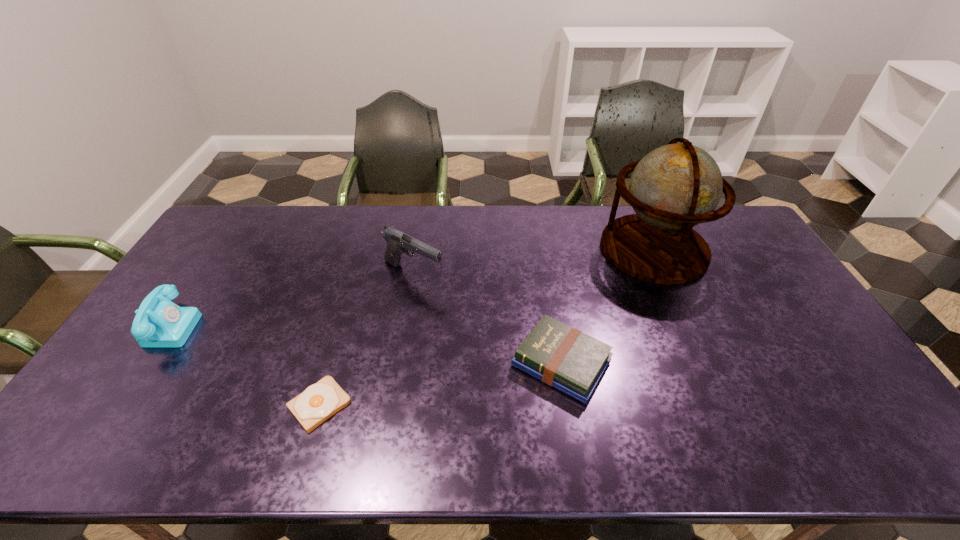
At what (x,y) coordinates should I click in order to perform the action: click on the tallest object. Please return your answer as a coordinate pair (x, y). Looking at the image, I should click on (675, 187).

Where is `the rightmost object`? This screenshot has height=540, width=960. the rightmost object is located at coordinates (675, 187).

Where is `gun`? Image resolution: width=960 pixels, height=540 pixels. gun is located at coordinates (398, 242).

Image resolution: width=960 pixels, height=540 pixels. I want to click on the leftmost object, so click(159, 323).

Where is `the third tallest object`? the third tallest object is located at coordinates (159, 323).

You are a GUI agent. You are given a task and a screenshot of the screen. Output one action in this format:
    pyautogui.click(x=<x>, y=<y>)
    Task: Click on the book
    Image resolution: width=960 pixels, height=540 pixels.
    Given the screenshot: What is the action you would take?
    pyautogui.click(x=563, y=357)

Locate an element on the screen. This screenshot has width=960, height=540. the fourth tallest object is located at coordinates (563, 357).

Identify the location of toast. (320, 401).

The width and height of the screenshot is (960, 540). What are the coordinates of `vacant position located on the front-facing side of the globe` in the screenshot? It's located at (720, 394).

This screenshot has width=960, height=540. I want to click on vacant space situated 0.050m at the muzzle of the gun, so click(x=461, y=274).